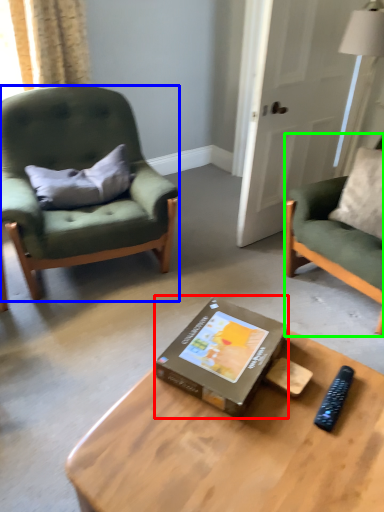
Question: Estimate the real-world distances between objects in this image. Which object is farther from box (highlighted by a red box), chair (highlighted by a blue box) or chair (highlighted by a green box)?

Choices:
 (A) chair
 (B) chair

Answer: (A)